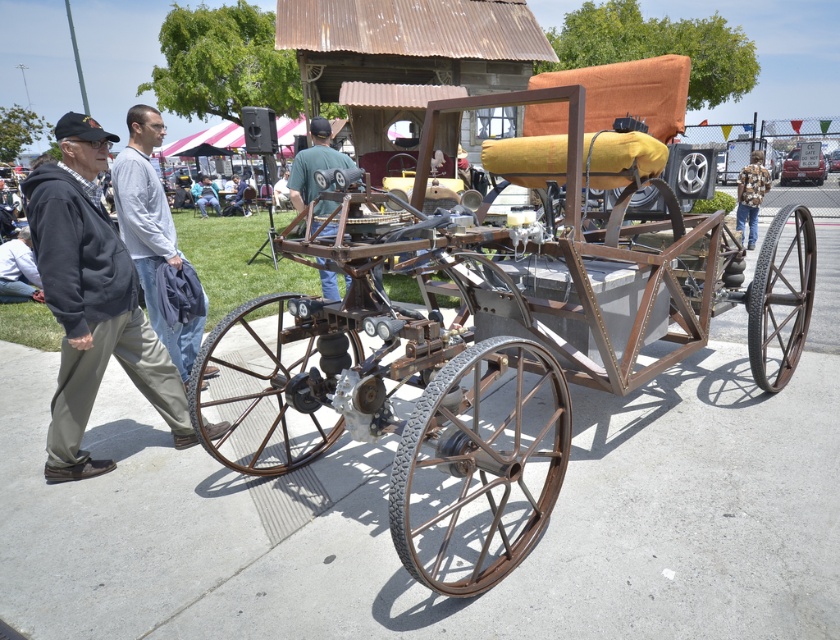
You are a visitor at a car museum and see the vintage vehicle. You notice two items near the front of the vehicle. One is the light gray sweater at left and the other is the light blue jeans at lower left. Which item is positioned closer to the front of the vehicle?

The light gray sweater at left is closer to the viewer than the light blue jeans at lower left, so it is positioned closer to the front of the vehicle.